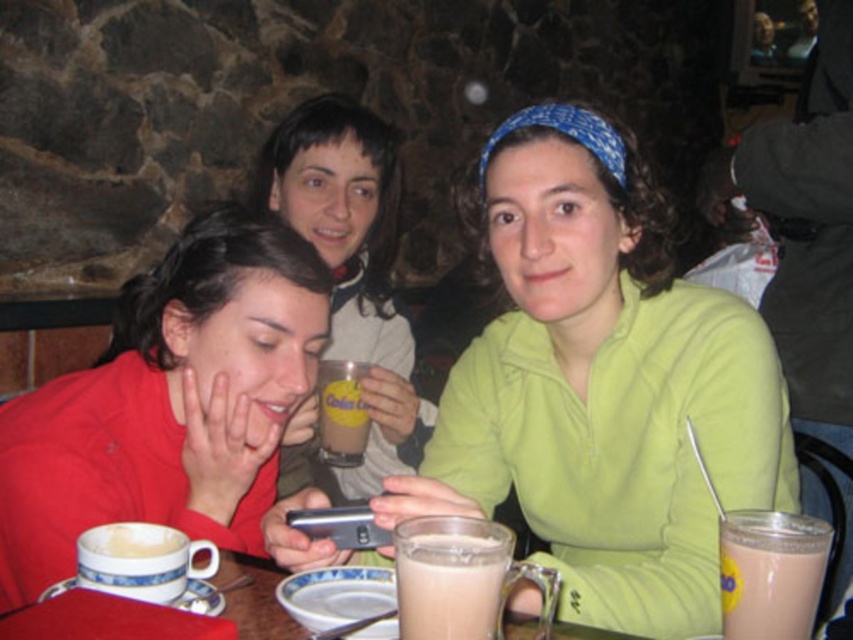
You are standing in the cozy cafe and want to find the green matte shirt at center. According to the coordinates provided, where should you look to locate it?

The green matte shirt at center is located at point coordinates of 0.603 on the x axis and 0.707 on the y axis.